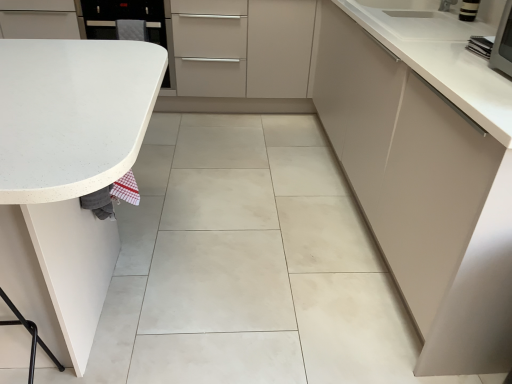
Question: Considering the relative sizes of white glossy oven at upper left and white glossy countertop at upper right, the first countertop from the top, in the image provided, is white glossy oven at upper left taller than white glossy countertop at upper right, the first countertop from the top,?

Choices:
 (A) no
 (B) yes

Answer: (B)

Question: From the image's perspective, is white glossy oven at upper left located beneath white glossy countertop at upper right, the first countertop from the top?

Choices:
 (A) yes
 (B) no

Answer: (B)

Question: Can you confirm if white glossy oven at upper left is shorter than white glossy countertop at upper right, the second countertop when ordered from left to right?

Choices:
 (A) no
 (B) yes

Answer: (A)

Question: Is white glossy oven at upper left far away from white glossy countertop at upper right, which ranks as the 1th countertop in right-to-left order?

Choices:
 (A) yes
 (B) no

Answer: (A)

Question: Is white glossy oven at upper left facing away from white glossy countertop at upper right, the second countertop when ordered from left to right?

Choices:
 (A) yes
 (B) no

Answer: (B)

Question: Would you say white glossy countertop at upper right, the first countertop from the top, is part of white glossy oven at upper left's contents?

Choices:
 (A) no
 (B) yes

Answer: (A)

Question: Considering the relative sizes of white glossy countertop at upper right, the first countertop from the top, and matte white cabinet at right in the image provided, is white glossy countertop at upper right, the first countertop from the top, thinner than matte white cabinet at right?

Choices:
 (A) yes
 (B) no

Answer: (A)

Question: Is white glossy countertop at upper right, marked as the second countertop in a bottom-to-top arrangement, positioned with its back to matte white cabinet at right?

Choices:
 (A) no
 (B) yes

Answer: (B)

Question: Is the position of white glossy countertop at upper right, the first countertop from the top, more distant than that of matte white cabinet at right?

Choices:
 (A) no
 (B) yes

Answer: (B)

Question: Would you say white glossy countertop at upper right, marked as the second countertop in a bottom-to-top arrangement, is outside matte white cabinet at right?

Choices:
 (A) yes
 (B) no

Answer: (B)

Question: Is white glossy countertop at upper right, marked as the second countertop in a bottom-to-top arrangement, taller than matte white cabinet at right?

Choices:
 (A) yes
 (B) no

Answer: (B)

Question: From a real-world perspective, does white glossy countertop at upper right, which ranks as the 1th countertop in right-to-left order, sit lower than matte white cabinet at right?

Choices:
 (A) yes
 (B) no

Answer: (B)

Question: From a real-world perspective, does white speckled laminate countertop at left, marked as the first countertop in a left-to-right arrangement, sit lower than white glossy countertop at upper right, the first countertop from the top?

Choices:
 (A) yes
 (B) no

Answer: (A)